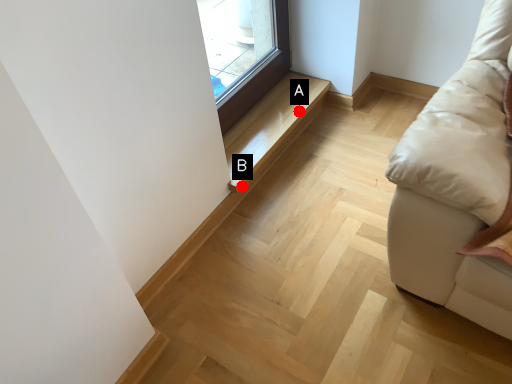
Question: Two points are circled on the image, labeled by A and B beside each circle. Among these points, which one is farthest from the camera?

Choices:
 (A) A is further
 (B) B is further

Answer: (A)